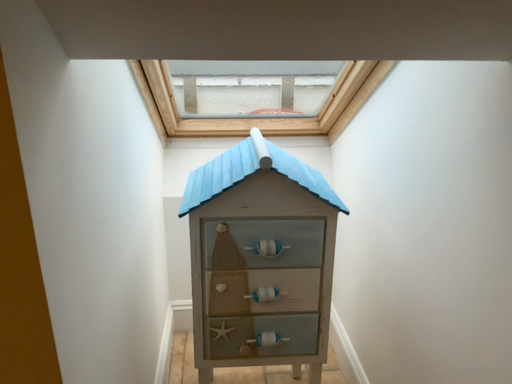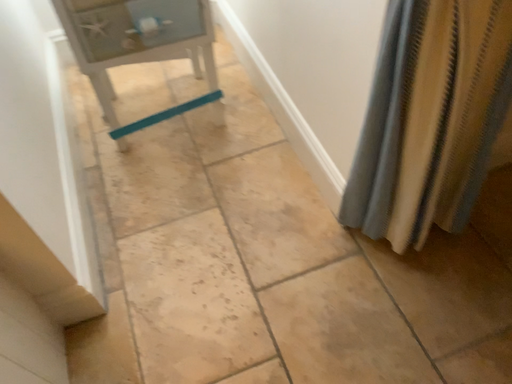
Question: Which way did the camera rotate in the video?

Choices:
 (A) rotated left
 (B) rotated right

Answer: (B)